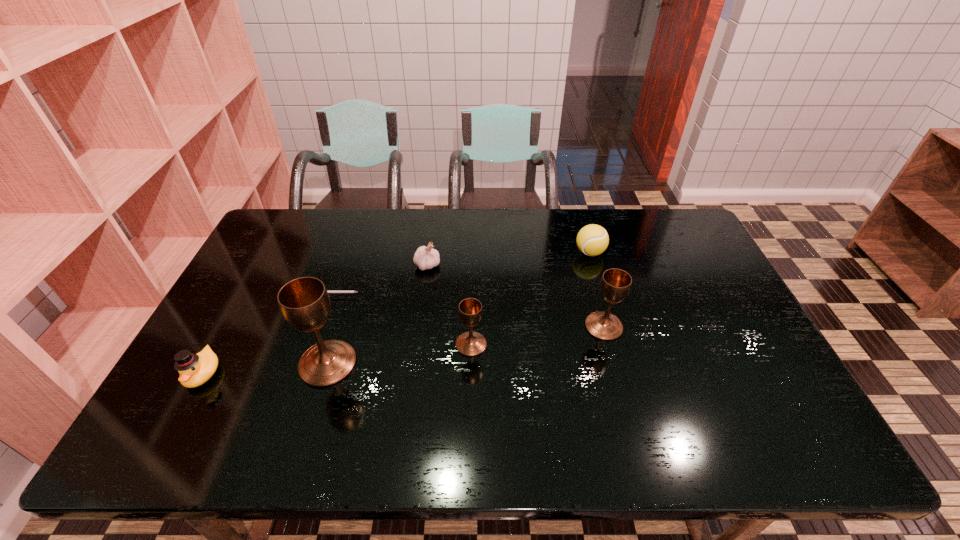
Please show where to add a chalice on the right while keeping spacing even. Please provide its 2D coordinates. Your answer should be formatted as a tuple, i.e. [(x, y)], where the tuple contains the x and y coordinates of a point satisfying the conditions above.

[(727, 310)]